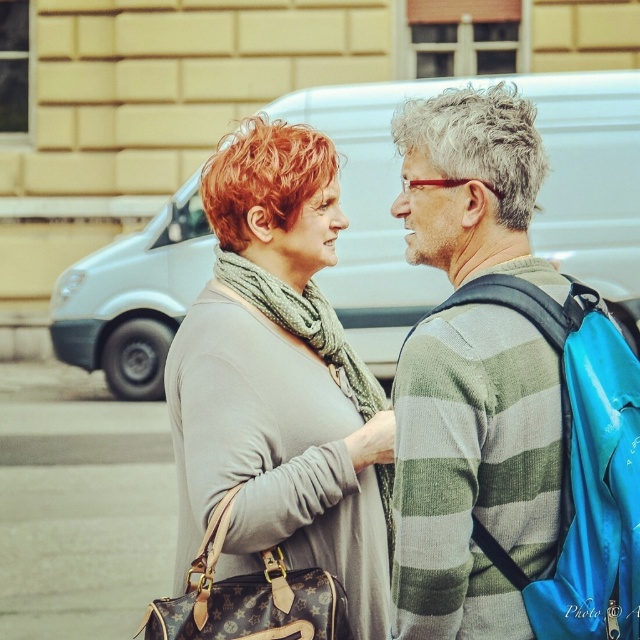
You are a fashion designer observing two people in the scene. You need to determine which item is shorter in height between the striped sweater at center and the matte gray scarf at center. Which one is it?

The striped sweater at center has a lesser height compared to the matte gray scarf at center, so the striped sweater at center is shorter in height.

You are a photographer trying to capture a closeup of the striped sweater at center and the matte gray scarf at center. Since you can only focus on one object at a time, which one should you choose to ensure it appears sharp in the photo?

The striped sweater at center is closer to the viewer than the matte gray scarf at center, so focusing on the striped sweater at center will keep it sharp while the scarf may appear slightly blurred. Alternatively, focusing on the matte gray scarf at center would require the sweater to be out of focus.